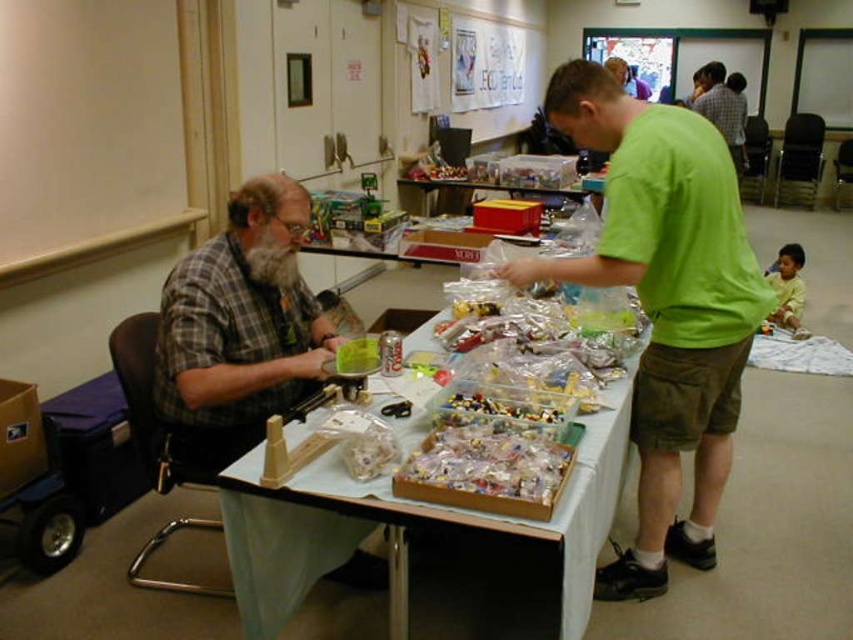
You are a delivery person who needs to place a package that is 16 feet long between the matte white board at upper left and the green matte shirt at upper center. Is there enough space to fit the package between them?

The distance between the matte white board at upper left and the green matte shirt at upper center is 16.66 feet, so the 16 feet long package can fit between them since it is shorter than the available space.

You are a guest at a party and see the matte white board at upper left and the green matte shirt at upper center. Which object is positioned more to the left side of the scene?

The matte white board at upper left is positioned more to the left side of the scene than the green matte shirt at upper center.